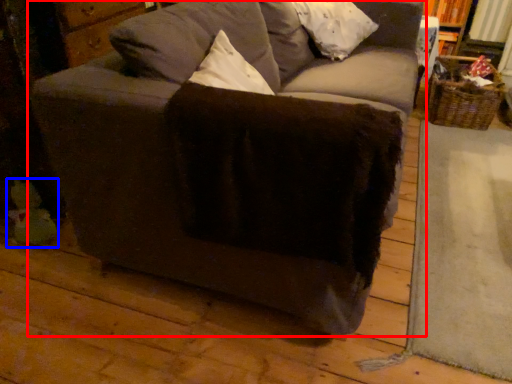
Question: Which object is further to the camera taking this photo, studio couch (highlighted by a red box) or toy (highlighted by a blue box)?

Choices:
 (A) studio couch
 (B) toy

Answer: (B)